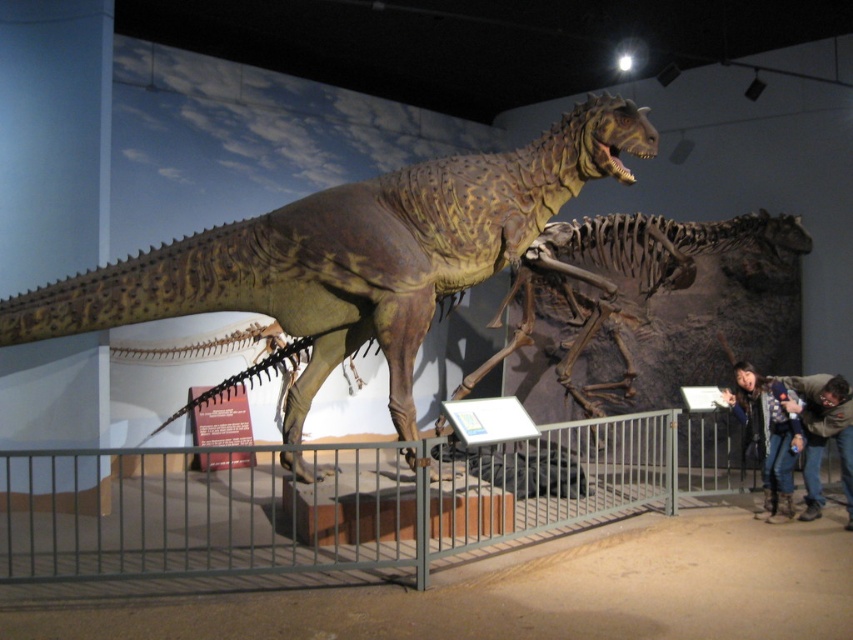
Question: Which of the following is the closest to the observer?

Choices:
 (A) (811, 429)
 (B) (683, 240)

Answer: (A)

Question: Is shiny brown dinosaur at center to the right of dark gray jeans at lower right from the viewer's perspective?

Choices:
 (A) no
 (B) yes

Answer: (A)

Question: Is shiny brown dinosaur at center below denim jacket at lower right?

Choices:
 (A) no
 (B) yes

Answer: (A)

Question: Based on their relative distances, which object is nearer to the brown textured skeleton at center?

Choices:
 (A) shiny brown dinosaur at center
 (B) denim jacket at lower right

Answer: (B)

Question: Which point is closer to the camera?

Choices:
 (A) pyautogui.click(x=556, y=403)
 (B) pyautogui.click(x=808, y=378)
 (C) pyautogui.click(x=74, y=285)

Answer: (C)

Question: In this image, where is brown textured skeleton at center located relative to denim jacket at lower right?

Choices:
 (A) below
 (B) above

Answer: (B)